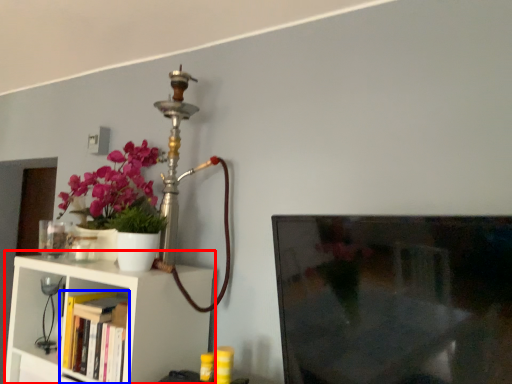
Question: Which object is further to the camera taking this photo, shelf (highlighted by a red box) or book (highlighted by a blue box)?

Choices:
 (A) shelf
 (B) book

Answer: (B)